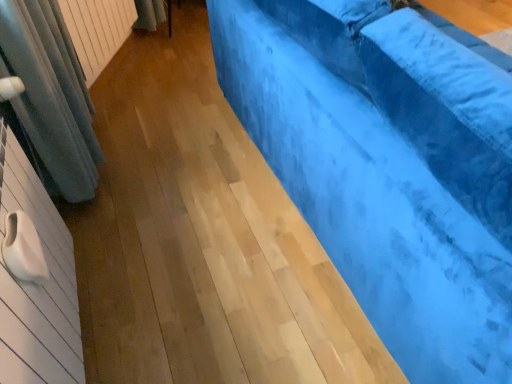
What do you see at coordinates (387, 167) in the screenshot?
I see `velvet blue couch at right` at bounding box center [387, 167].

In order to face velvet blue couch at right, should I rotate leftwards or rightwards?

Rotate right and turn 20.618 degrees.

The image size is (512, 384). In order to click on velvet blue couch at right in this screenshot , I will do `click(387, 167)`.

Where is `white textured radiator at upper left`? This screenshot has height=384, width=512. white textured radiator at upper left is located at coordinates (97, 30).

Measure the distance between point (116, 0) and camera.

The depth of point (116, 0) is 8.14 feet.

What is the approximate width of white textured radiator at upper left?

4.02 inches.

This screenshot has width=512, height=384. Describe the element at coordinates (97, 30) in the screenshot. I see `white textured radiator at upper left` at that location.

What is the approximate height of white textured radiator at upper left?

white textured radiator at upper left is 43.79 centimeters in height.

In order to face white textured radiator at upper left, should I rotate leftwards or rightwards?

Rotate your view left by about 19.522°.

At what (x,y) coordinates should I click in order to perform the action: click on velvet blue couch at right. Please return your answer as a coordinate pair (x, y). This screenshot has height=384, width=512. Looking at the image, I should click on (387, 167).

Between velvet blue couch at right and white textured radiator at upper left, which one appears on the left side from the viewer's perspective?

white textured radiator at upper left.

Is velvet blue couch at right further to the viewer compared to white textured radiator at upper left?

No, it is not.

Considering the positions of point (395, 231) and point (94, 75), is point (395, 231) closer or farther from the camera than point (94, 75)?

Point (395, 231) is positioned closer to the camera compared to point (94, 75).

From the image's perspective, is velvet blue couch at right located beneath white textured radiator at upper left?

Correct, velvet blue couch at right appears lower than white textured radiator at upper left in the image.

From a real-world perspective, does velvet blue couch at right stand above white textured radiator at upper left?

Yes.

Can you confirm if velvet blue couch at right is thinner than white textured radiator at upper left?

Incorrect, the width of velvet blue couch at right is not less than that of white textured radiator at upper left.

Can you confirm if velvet blue couch at right is taller than white textured radiator at upper left?

Yes.

Which of these two, velvet blue couch at right or white textured radiator at upper left, is smaller?

Smaller between the two is white textured radiator at upper left.

Is velvet blue couch at right positioned beyond the bounds of white textured radiator at upper left?

velvet blue couch at right lies outside white textured radiator at upper left's area.

Are velvet blue couch at right and white textured radiator at upper left far apart?

velvet blue couch at right is far away from white textured radiator at upper left.

Is velvet blue couch at right oriented towards white textured radiator at upper left?

No, velvet blue couch at right is not oriented towards white textured radiator at upper left.

How far apart are velvet blue couch at right and white textured radiator at upper left?

They are 1.39 meters apart.

At what (x,y) coordinates should I click in order to perform the action: click on furniture to the right of white textured radiator at upper left. Please return your answer as a coordinate pair (x, y). Looking at the image, I should click on (387, 167).

Which is more to the left, white textured radiator at upper left or velvet blue couch at right?

From the viewer's perspective, white textured radiator at upper left appears more on the left side.

Does white textured radiator at upper left lie behind velvet blue couch at right?

Yes, white textured radiator at upper left is behind velvet blue couch at right.

Between point (122, 18) and point (338, 202), which one is positioned in front?

The point (338, 202) is in front.

From the image's perspective, is white textured radiator at upper left above or below velvet blue couch at right?

From the image's perspective, white textured radiator at upper left appears above velvet blue couch at right.

From a real-world perspective, between white textured radiator at upper left and velvet blue couch at right, who is vertically higher?

velvet blue couch at right.

Considering the sizes of objects white textured radiator at upper left and velvet blue couch at right in the image provided, who is thinner, white textured radiator at upper left or velvet blue couch at right?

With smaller width is white textured radiator at upper left.

Consider the image. Is white textured radiator at upper left shorter than velvet blue couch at right?

Indeed, white textured radiator at upper left has a lesser height compared to velvet blue couch at right.

Which of these two, white textured radiator at upper left or velvet blue couch at right, is bigger?

Bigger between the two is velvet blue couch at right.

Can velvet blue couch at right be found inside white textured radiator at upper left?

No, white textured radiator at upper left does not contain velvet blue couch at right.

Is white textured radiator at upper left placed right next to velvet blue couch at right?

No, white textured radiator at upper left is not making contact with velvet blue couch at right.

Is white textured radiator at upper left oriented away from velvet blue couch at right?

No, white textured radiator at upper left is not facing the opposite direction of velvet blue couch at right.

Measure the distance from white textured radiator at upper left to velvet blue couch at right.

white textured radiator at upper left and velvet blue couch at right are 1.39 meters apart from each other.

Where is `radiator lying behind the velvet blue couch at right`? The image size is (512, 384). radiator lying behind the velvet blue couch at right is located at coordinates [97, 30].

Find the location of a particular element. The height and width of the screenshot is (384, 512). radiator behind the velvet blue couch at right is located at coordinates (97, 30).

At what (x,y) coordinates should I click in order to perform the action: click on furniture in front of the white textured radiator at upper left. Please return your answer as a coordinate pair (x, y). Looking at the image, I should click on (387, 167).